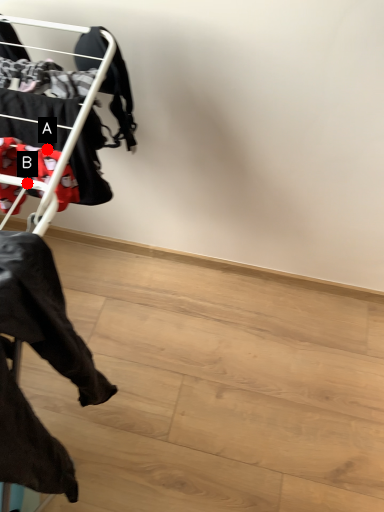
Question: Two points are circled on the image, labeled by A and B beside each circle. Which point appears closest to the camera in this image?

Choices:
 (A) A is closer
 (B) B is closer

Answer: (B)